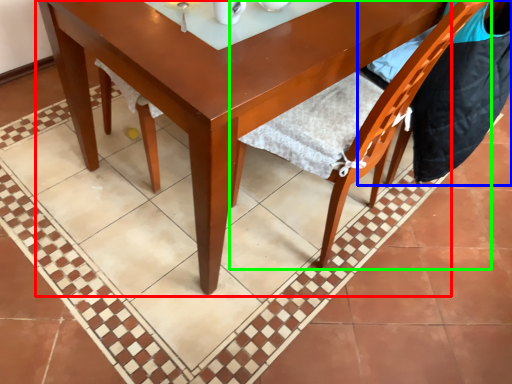
Question: Which is nearer to the round table (highlighted by a red box)? chair (highlighted by a blue box) or chair (highlighted by a green box).

Choices:
 (A) chair
 (B) chair

Answer: (B)